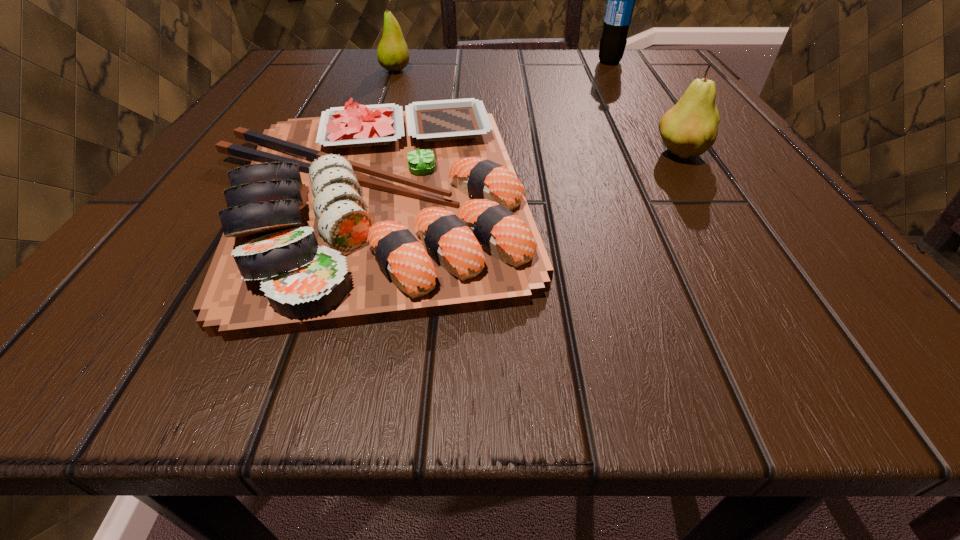
You are a GUI agent. You are given a task and a screenshot of the screen. Output one action in this format:
    pyautogui.click(x=<x>, y=<y>)
    Task: Click on the vacant space at the far right corner of the desktop
    
    Given the screenshot: What is the action you would take?
    pyautogui.click(x=636, y=51)

The width and height of the screenshot is (960, 540). Find the location of `vacant space at the near right corner`. vacant space at the near right corner is located at coordinates [794, 302].

Locate an element on the screen. free spot between the tallest object and the nearer pear is located at coordinates (645, 108).

Where is `free area in between the nearer pear and the soda bottle`? This screenshot has width=960, height=540. free area in between the nearer pear and the soda bottle is located at coordinates (645, 108).

The width and height of the screenshot is (960, 540). Find the location of `vacant region between the nearer pear and the left pear`. vacant region between the nearer pear and the left pear is located at coordinates (538, 112).

At what (x,y) coordinates should I click in order to perform the action: click on vacant area between the shortest object and the right pear. Please return your answer as a coordinate pair (x, y). Image resolution: width=960 pixels, height=540 pixels. Looking at the image, I should click on (524, 175).

The height and width of the screenshot is (540, 960). I want to click on empty space between the left pear and the tallest object, so click(x=502, y=66).

The height and width of the screenshot is (540, 960). I want to click on object that is the second nearest to the platter, so click(x=690, y=127).

Locate which object ranks third in proximity to the nearer pear. Please provide its 2D coordinates. Your answer should be formatted as a tuple, i.e. [(x, y)], where the tuple contains the x and y coordinates of a point satisfying the conditions above.

[(392, 53)]

Find the location of `free space that satisfies the following two spatial constraints: 1. on the back side of the tallest object; 2. on the right side of the left pear`. free space that satisfies the following two spatial constraints: 1. on the back side of the tallest object; 2. on the right side of the left pear is located at coordinates (398, 62).